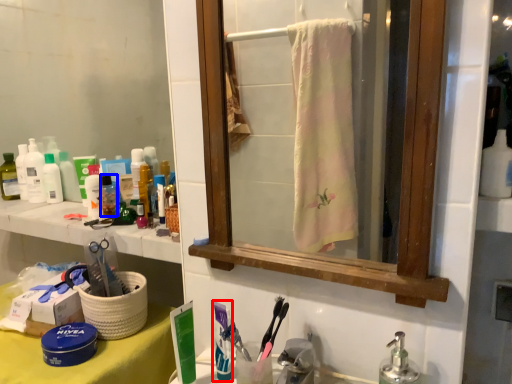
Question: Which object appears closest to the camera in this image, toothpaste (highlighted by a red box) or mouthwash (highlighted by a blue box)?

Choices:
 (A) toothpaste
 (B) mouthwash

Answer: (A)